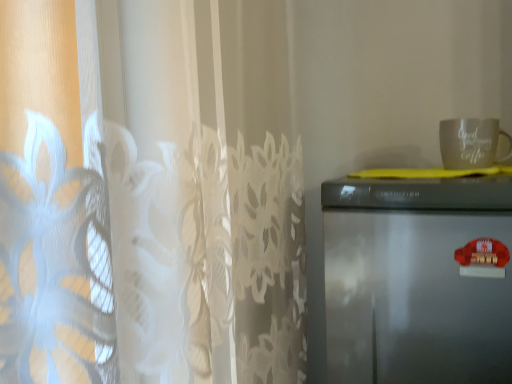
Question: Is point (422, 289) closer or farther from the camera than point (441, 124)?

Choices:
 (A) closer
 (B) farther

Answer: (A)

Question: From the image's perspective, is satin silver refrigerator at right located above or below matte white mug at upper right?

Choices:
 (A) below
 (B) above

Answer: (A)

Question: From a real-world perspective, is satin silver refrigerator at right positioned above or below matte white mug at upper right?

Choices:
 (A) below
 (B) above

Answer: (A)

Question: From the image's perspective, is matte white mug at upper right located above or below satin silver refrigerator at right?

Choices:
 (A) below
 (B) above

Answer: (B)

Question: Does point (456, 152) appear closer or farther from the camera than point (443, 253)?

Choices:
 (A) closer
 (B) farther

Answer: (B)

Question: From a real-world perspective, is matte white mug at upper right physically located above or below satin silver refrigerator at right?

Choices:
 (A) above
 (B) below

Answer: (A)

Question: Considering the positions of matte white mug at upper right and satin silver refrigerator at right in the image, is matte white mug at upper right bigger or smaller than satin silver refrigerator at right?

Choices:
 (A) big
 (B) small

Answer: (B)